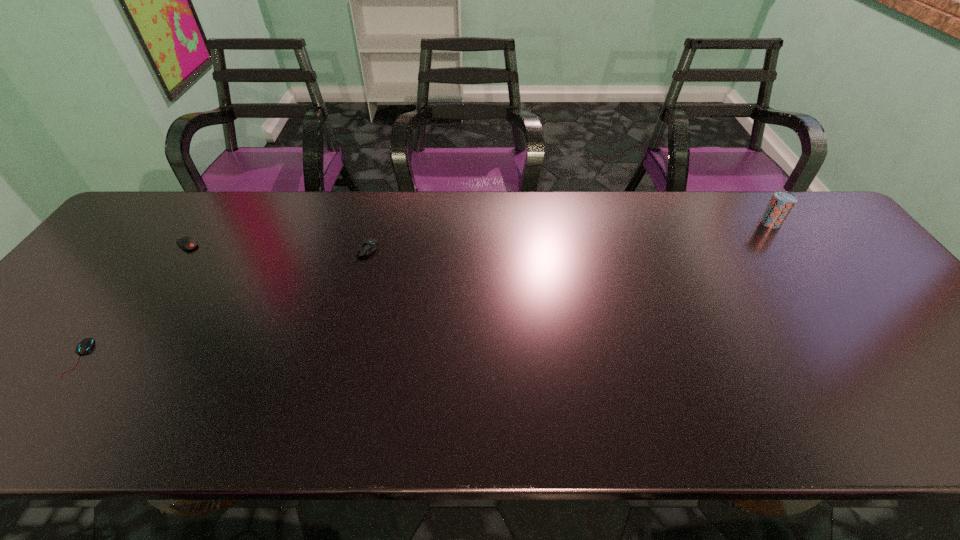
The width and height of the screenshot is (960, 540). I want to click on the tallest object, so click(x=779, y=207).

This screenshot has width=960, height=540. What are the coordinates of `the farthest object` in the screenshot? It's located at (779, 207).

Identify the location of the rightmost mouse. (366, 247).

Locate an element on the screen. the second mouse from left to right is located at coordinates (186, 243).

Where is `the shortest mouse`? the shortest mouse is located at coordinates (86, 344).

The width and height of the screenshot is (960, 540). In order to click on the leftmost mouse in this screenshot , I will do `click(86, 344)`.

This screenshot has height=540, width=960. I want to click on vacant space located on the left of the tallest object, so click(x=667, y=222).

Locate an element on the screen. The width and height of the screenshot is (960, 540). vacant space situated on the back of the rightmost mouse is located at coordinates (373, 225).

The height and width of the screenshot is (540, 960). I want to click on vacant position located 0.070m on the right of the second mouse from right to left, so click(224, 245).

Where is `vacant space situated on the right of the leftmost object`? Image resolution: width=960 pixels, height=540 pixels. vacant space situated on the right of the leftmost object is located at coordinates (164, 358).